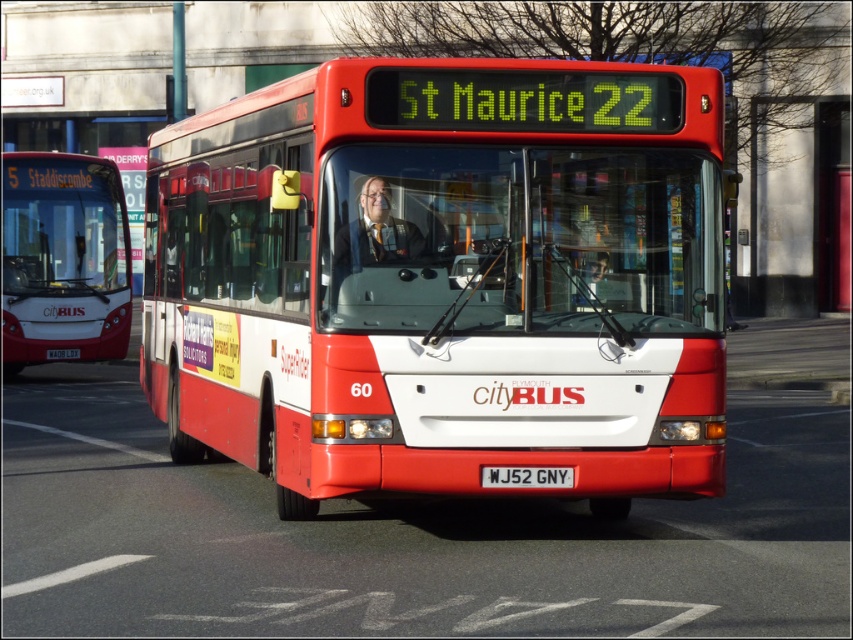
Who is higher up, matte red bus at center or white plastic license plate at center?

matte red bus at center

Between matte red bus at center and white plastic license plate at center, which one appears on the left side from the viewer's perspective?

From the viewer's perspective, matte red bus at center appears more on the left side.

Is point (401, 204) closer to camera compared to point (560, 486)?

No, it is behind (560, 486).

The width and height of the screenshot is (853, 640). Identify the location of matte red bus at center. (445, 280).

Between matte red bus at center and matte black bus at left, which one is positioned lower?

matte red bus at center is lower down.

This screenshot has height=640, width=853. What do you see at coordinates (445, 280) in the screenshot?
I see `matte red bus at center` at bounding box center [445, 280].

I want to click on matte red bus at center, so point(445,280).

Which is in front, point (108, 205) or point (558, 486)?

Point (558, 486)

This screenshot has height=640, width=853. I want to click on matte black bus at left, so click(x=62, y=259).